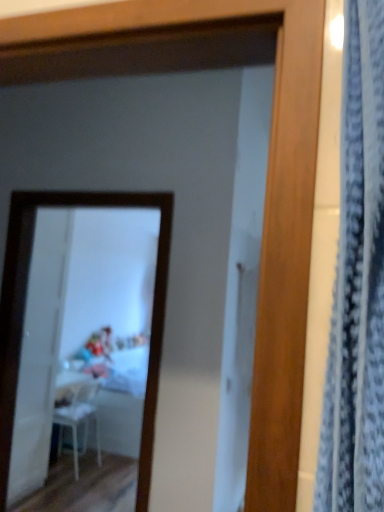
At what (x,y) coordinates should I click in order to perform the action: click on free space above white glossy mirror at upper center (from a real-world perspective). Please return your answer as a coordinate pair (x, y). Looking at the image, I should click on click(x=77, y=187).